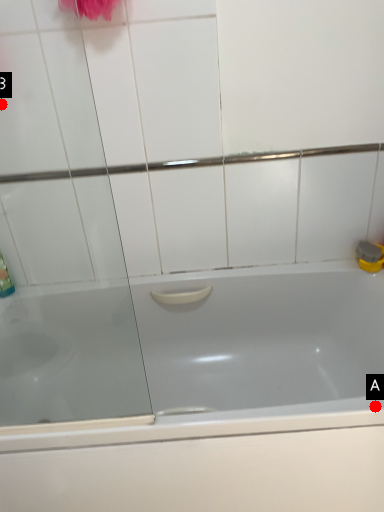
Question: Two points are circled on the image, labeled by A and B beside each circle. Which point is closer to the camera taking this photo?

Choices:
 (A) A is closer
 (B) B is closer

Answer: (A)